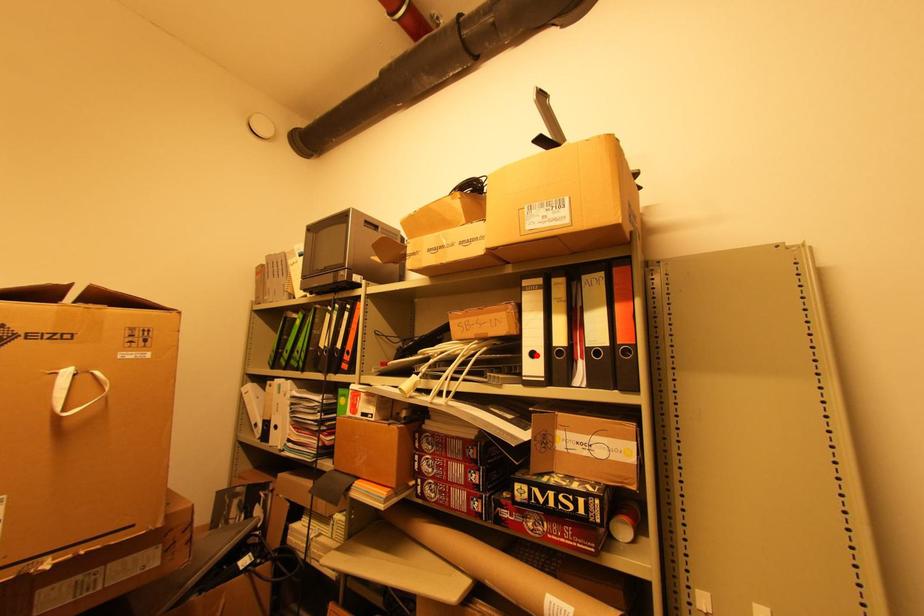
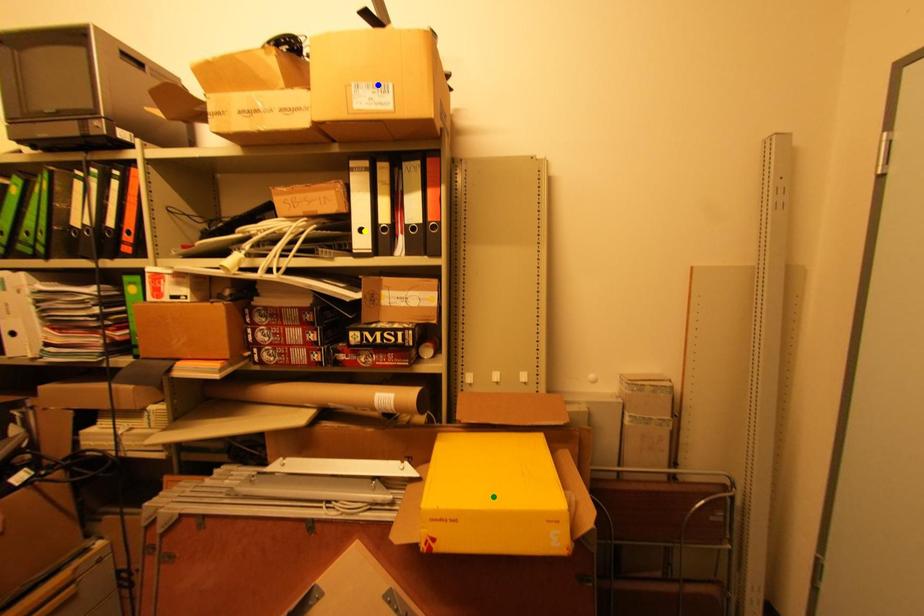
Question: I am providing you with two images of the same scene from different viewpoints. A red point is marked on the first image. You are given multiple points on the second image. In image 2, which mark is for the same physical point as the one in image 1?

Choices:
 (A) green point
 (B) yellow point
 (C) blue point

Answer: (B)